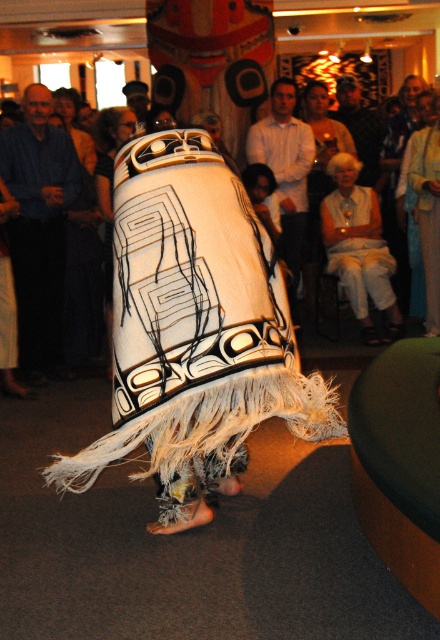
You are an event photographer at the cultural performance. You want to capture a clear shot of the white woven fabric at center without the smooth brown leather jacket at upper center blocking it. Is this possible given their positions?

The white woven fabric at center is in front of the smooth brown leather jacket at upper center, so it will block the view of the jacket. To capture the jacket clearly, you need to adjust your angle or position to avoid the fabric obstructing it.

You are a photographer standing at the camera position. You want to take a closeup shot of the white woven fabric at center. Can you move closer to the fabric to get a better shot without exceeding the 5 meter limit?

The distance between the white woven fabric at center and the camera is 4.99 meters, which is under the 5 meter limit. Therefore, you can move closer to the fabric to get a better shot without exceeding the limit.

You are attending the cultural performance and want to locate the blue cotton shirt at left. According to the coordinates provided, where exactly would you look to find it?

The blue cotton shirt at left is located at coordinates point 0.356 on the x axis and 0.089 on the y axis.